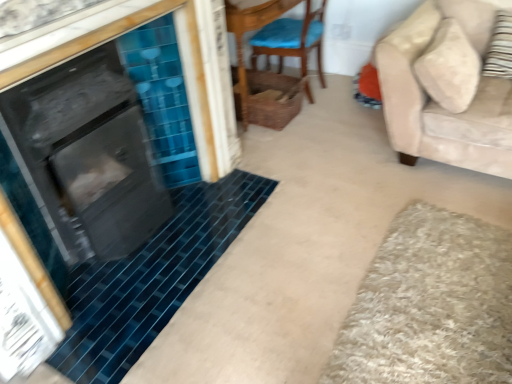
Question: Looking at the image, does beige shaggy bath mat at lower right seem bigger or smaller compared to woven wicker basket at upper center?

Choices:
 (A) small
 (B) big

Answer: (A)

Question: In the image, is beige shaggy bath mat at lower right on the left side or the right side of woven wicker basket at upper center?

Choices:
 (A) left
 (B) right

Answer: (B)

Question: Which object is the farthest from the woven wicker basket at upper center?

Choices:
 (A) striped fabric pillow at right
 (B) woven brown basket at center
 (C) beige shaggy bath mat at lower right
 (D) wooden chair with blue cushion at center
 (E) beige fabric couch at right

Answer: (C)

Question: Estimate the real-world distances between objects in this image. Which object is farther from the beige shaggy bath mat at lower right?

Choices:
 (A) striped fabric pillow at right
 (B) woven brown basket at center
 (C) beige fabric couch at right
 (D) woven wicker basket at upper center
 (E) wooden chair with blue cushion at center

Answer: (E)